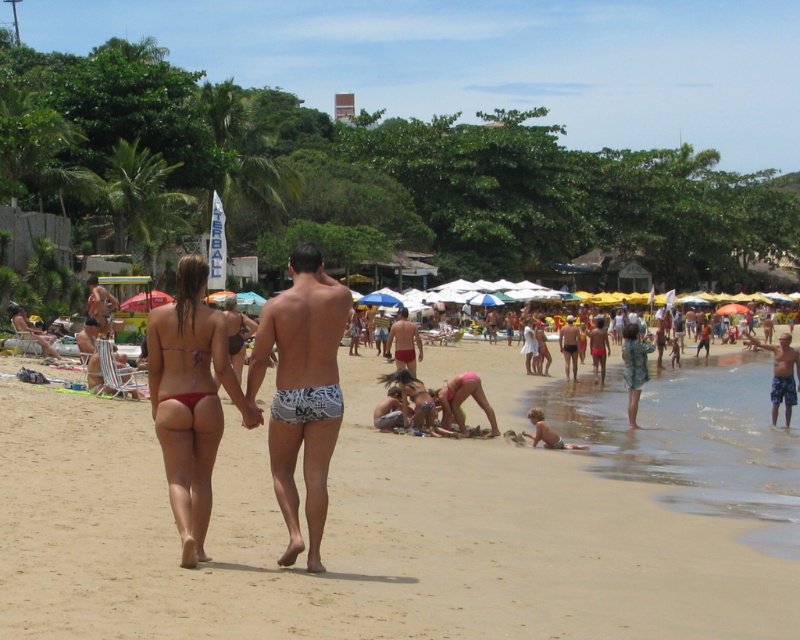
You are a photographer on the beach and want to capture a photo of the blue plaid shorts at lower right and the red matte swim trunks at center. Based on their positions, which one is closer to the bottom edge of the photo?

The blue plaid shorts at lower right is below the red matte swim trunks at center, so it is closer to the bottom edge of the photo.

You are a photographer trying to capture a photo of the matte pink bikini at center and the matte black swim trunks at center. Based on their positions, which one is closer to the camera?

The matte pink bikini at center is positioned under the matte black swim trunks at center, which means it is closer to the camera.